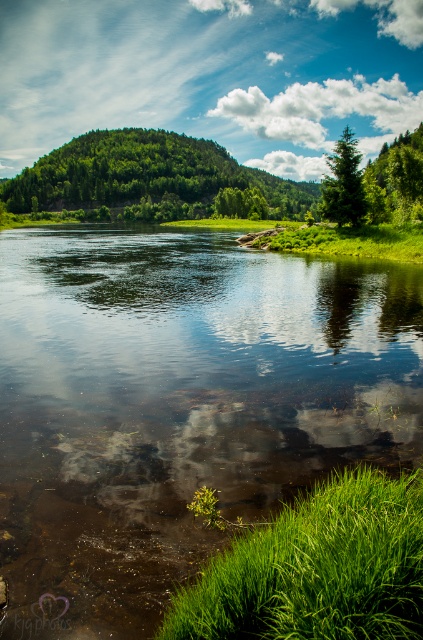
Question: Which object is the closest to the green leafy tree at upper right?

Choices:
 (A) clear water at center
 (B) green grass at lower right
 (C) green leafy tree at upper left
 (D) green matte tree at upper right

Answer: (A)

Question: Can you confirm if green grass at lower right is bigger than green leafy tree at upper right?

Choices:
 (A) yes
 (B) no

Answer: (B)

Question: Does clear water at center appear on the right side of green leafy tree at upper left?

Choices:
 (A) no
 (B) yes

Answer: (B)

Question: Which of the following is the farthest from the observer?

Choices:
 (A) (362, 560)
 (B) (392, 172)
 (C) (153, 291)
 (D) (96, 189)

Answer: (D)

Question: Which object is the closest to the green matte tree at upper right?

Choices:
 (A) green leafy tree at upper right
 (B) green grass at lower right

Answer: (B)

Question: From the image, what is the correct spatial relationship of green leafy tree at upper left in relation to green leafy tree at upper right?

Choices:
 (A) below
 (B) above

Answer: (B)